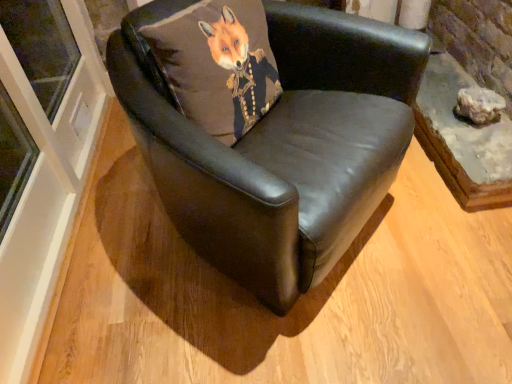
Find the location of `free spot in front of matte gray rock at right`. free spot in front of matte gray rock at right is located at coordinates (484, 142).